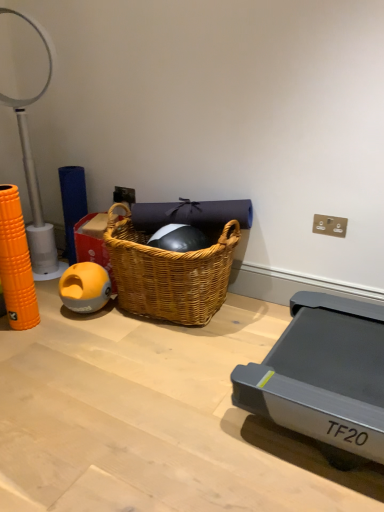
Identify the location of vacant area that lies in front of yellow rubber ball at left. The height and width of the screenshot is (512, 384). (85, 329).